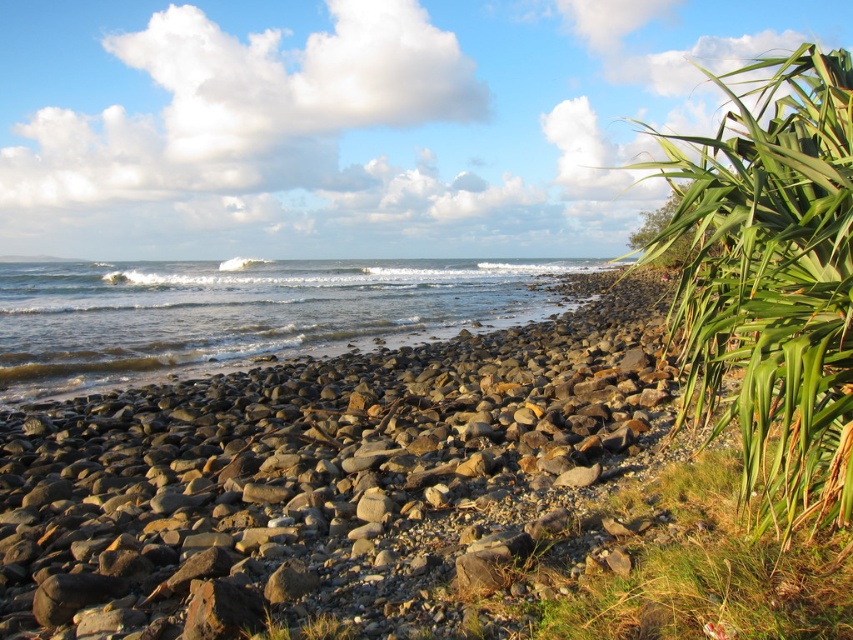
You are standing at the edge of the rocky beach in the coastal scene. You see two points marked on the image. The first point is at coordinates point (814,412), and the second is at point (323,636). Which point is closer to your current position?

Point (814,412) is closer to the camera than point (323,636), so the first point is closer to your current position.

You are a hiker who has just arrived at the beach. You notice the green leafy plant at right and the clear water at center. Which object is positioned closer to the bottom edge of the image?

The green leafy plant at right is located below clear water at center, meaning it is closer to the bottom edge of the image.